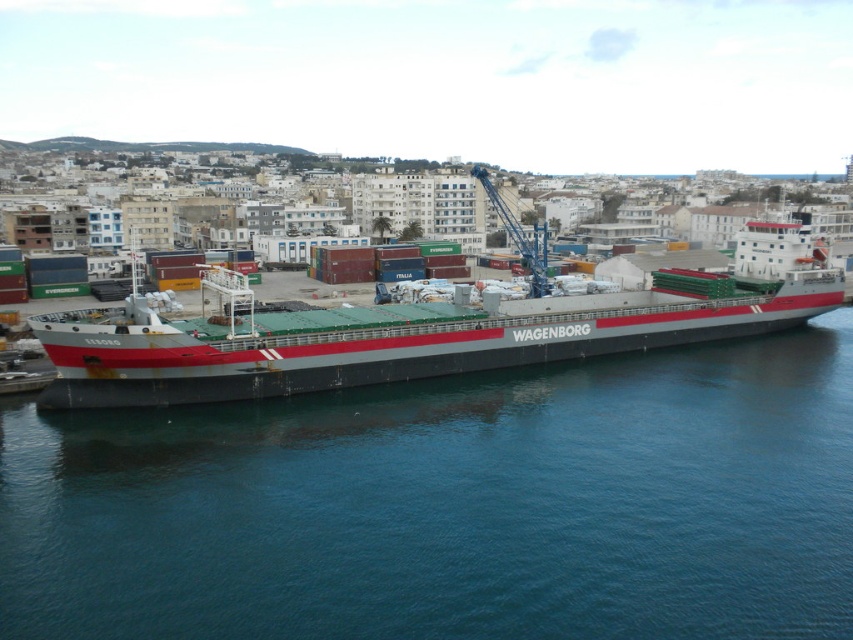
Question: Which object is closer to the camera taking this photo?

Choices:
 (A) smooth dark blue water at center
 (B) gray matte cargo ship at center

Answer: (A)

Question: Which object is farther from the camera taking this photo?

Choices:
 (A) smooth dark blue water at center
 (B) gray matte cargo ship at center

Answer: (B)

Question: Is smooth dark blue water at center below gray matte cargo ship at center?

Choices:
 (A) no
 (B) yes

Answer: (B)

Question: From the image, what is the correct spatial relationship of smooth dark blue water at center in relation to gray matte cargo ship at center?

Choices:
 (A) left
 (B) right

Answer: (B)

Question: Can you confirm if smooth dark blue water at center is positioned to the left of gray matte cargo ship at center?

Choices:
 (A) yes
 (B) no

Answer: (B)

Question: Which object is farther from the camera taking this photo?

Choices:
 (A) smooth dark blue water at center
 (B) gray matte cargo ship at center

Answer: (B)